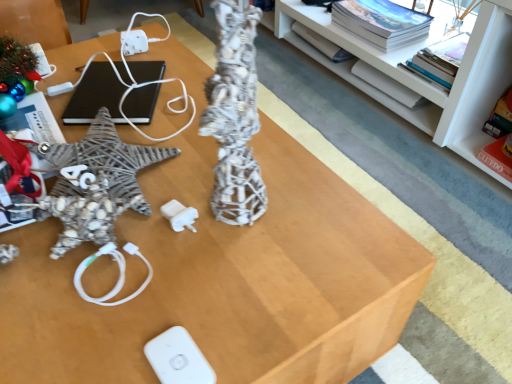
Locate an element on the screen. This screenshot has width=512, height=384. black matte laptop at upper left is located at coordinates (95, 96).

Measure the distance between black matte laptop at upper left and camera.

The distance of black matte laptop at upper left from camera is 36.25 inches.

What is the approximate height of shiny metallic ornament at upper left?

It is 7.13 centimeters.

What are the coordinates of `shiny metallic ornament at upper left` in the screenshot? It's located at (16, 62).

I want to click on black matte laptop at upper left, so click(95, 96).

From a real-world perspective, relative to black matte laptop at upper left, is white matte wii controller at lower center vertically above or below?

Clearly, from a real-world perspective, white matte wii controller at lower center is below black matte laptop at upper left.

Between white matte wii controller at lower center and black matte laptop at upper left, which one is positioned behind?

black matte laptop at upper left is further away from the camera.

Considering the relative sizes of white matte wii controller at lower center and black matte laptop at upper left in the image provided, is white matte wii controller at lower center wider than black matte laptop at upper left?

Incorrect, the width of white matte wii controller at lower center does not surpass that of black matte laptop at upper left.

From the image's perspective, is white matte wii controller at lower center beneath black matte laptop at upper left?

Yes.

Is shiny metallic ornament at upper left at the right side of black matte laptop at upper left?

In fact, shiny metallic ornament at upper left is to the left of black matte laptop at upper left.

Does shiny metallic ornament at upper left have a greater height compared to black matte laptop at upper left?

Correct, shiny metallic ornament at upper left is much taller as black matte laptop at upper left.

Does shiny metallic ornament at upper left turn towards black matte laptop at upper left?

No, shiny metallic ornament at upper left is not turned towards black matte laptop at upper left.

Is shiny metallic ornament at upper left thinner than black matte laptop at upper left?

Yes, shiny metallic ornament at upper left is thinner than black matte laptop at upper left.

From the image's perspective, relative to black matte laptop at upper left, is white glossy shelf at upper center above or below?

Based on their image positions, white glossy shelf at upper center is located above black matte laptop at upper left.

Does white glossy shelf at upper center touch black matte laptop at upper left?

They are not placed beside each other.

Does white glossy shelf at upper center have a greater height compared to black matte laptop at upper left?

Yes, white glossy shelf at upper center is taller than black matte laptop at upper left.

Which object is more forward, white glossy shelf at upper center or black matte laptop at upper left?

white glossy shelf at upper center is closer to the camera.

Is white glossy shelf at upper center at the left side of white matte wii controller at lower center?

No.

Is the depth of white glossy shelf at upper center greater than that of white matte wii controller at lower center?

Yes, white glossy shelf at upper center is behind white matte wii controller at lower center.

Is white glossy shelf at upper center not inside white matte wii controller at lower center?

Absolutely, white glossy shelf at upper center is external to white matte wii controller at lower center.

Based on the photo, considering the sizes of objects white glossy shelf at upper center and white matte wii controller at lower center in the image provided, who is bigger, white glossy shelf at upper center or white matte wii controller at lower center?

Bigger between the two is white glossy shelf at upper center.

Between white matte wii controller at lower center and shiny metallic ornament at upper left, which one is positioned in front?

white matte wii controller at lower center is more forward.

Which is correct: white matte wii controller at lower center is inside shiny metallic ornament at upper left, or outside of it?

white matte wii controller at lower center is spatially situated outside shiny metallic ornament at upper left.

From a real-world perspective, is white matte wii controller at lower center physically below shiny metallic ornament at upper left?

Yes, from a real-world perspective, white matte wii controller at lower center is beneath shiny metallic ornament at upper left.

Looking at this image, is white glossy shelf at upper center completely or partially inside shiny metallic ornament at upper left?

No, shiny metallic ornament at upper left does not contain white glossy shelf at upper center.

From a real-world perspective, is shiny metallic ornament at upper left positioned over white glossy shelf at upper center based on gravity?

Indeed, from a real-world perspective, shiny metallic ornament at upper left stands above white glossy shelf at upper center.

Are shiny metallic ornament at upper left and white glossy shelf at upper center far apart?

Yes, shiny metallic ornament at upper left is far from white glossy shelf at upper center.

Does shiny metallic ornament at upper left have a lesser width compared to white glossy shelf at upper center?

Correct, the width of shiny metallic ornament at upper left is less than that of white glossy shelf at upper center.

Visually, is white glossy shelf at upper center positioned to the left or to the right of shiny metallic ornament at upper left?

From the image, it's evident that white glossy shelf at upper center is to the right of shiny metallic ornament at upper left.

Between point (438, 101) and point (6, 82), which one is positioned behind?

The point (438, 101) is more distant.

Is white glossy shelf at upper center located outside shiny metallic ornament at upper left?

Yes, white glossy shelf at upper center is not within shiny metallic ornament at upper left.

Considering the relative sizes of white glossy shelf at upper center and shiny metallic ornament at upper left in the image provided, is white glossy shelf at upper center taller than shiny metallic ornament at upper left?

Yes, white glossy shelf at upper center is taller than shiny metallic ornament at upper left.

Locate an element on the screen. The width and height of the screenshot is (512, 384). laptop above the white matte wii controller at lower center (from a real-world perspective) is located at coordinates (95, 96).

Where is `christmas decoration behind the black matte laptop at upper left`? The width and height of the screenshot is (512, 384). christmas decoration behind the black matte laptop at upper left is located at coordinates (16, 62).

Based on their spatial positions, is shiny metallic ornament at upper left or black matte laptop at upper left closer to white glossy shelf at upper center?

black matte laptop at upper left is positioned closer to the anchor white glossy shelf at upper center.

When comparing their distances from white glossy shelf at upper center, does black matte laptop at upper left or shiny metallic ornament at upper left seem further?

Answer: shiny metallic ornament at upper left is further to white glossy shelf at upper center.

Estimate the real-world distances between objects in this image. Which object is closer to shiny metallic ornament at upper left, white matte wii controller at lower center or white glossy shelf at upper center?

The object closer to shiny metallic ornament at upper left is white matte wii controller at lower center.

When comparing their distances from white glossy shelf at upper center, does shiny metallic ornament at upper left or white matte wii controller at lower center seem further?

The object further to white glossy shelf at upper center is white matte wii controller at lower center.

Estimate the real-world distances between objects in this image. Which object is closer to black matte laptop at upper left, white glossy shelf at upper center or shiny metallic ornament at upper left?

shiny metallic ornament at upper left.

Which object lies nearer to the anchor point white matte wii controller at lower center, black matte laptop at upper left or white glossy shelf at upper center?

black matte laptop at upper left is closer to white matte wii controller at lower center.

When comparing their distances from black matte laptop at upper left, does white matte wii controller at lower center or shiny metallic ornament at upper left seem closer?

shiny metallic ornament at upper left lies closer to black matte laptop at upper left than the other object.

Looking at the image, which one is located further to shiny metallic ornament at upper left, black matte laptop at upper left or white glossy shelf at upper center?

white glossy shelf at upper center is further to shiny metallic ornament at upper left.

The image size is (512, 384). Identify the location of laptop that lies between shiny metallic ornament at upper left and white matte wii controller at lower center from top to bottom. (95, 96).

You are a GUI agent. You are given a task and a screenshot of the screen. Output one action in this format:
    pyautogui.click(x=<x>, y=<y>)
    Task: Click on the laptop located between shiny metallic ornament at upper left and white glossy shelf at upper center in the left-right direction
    Image resolution: width=512 pixels, height=384 pixels.
    Given the screenshot: What is the action you would take?
    pyautogui.click(x=95, y=96)

The width and height of the screenshot is (512, 384). What are the coordinates of `laptop between white glossy shelf at upper center and white matte wii controller at lower center from top to bottom` in the screenshot? It's located at (95, 96).

Identify the location of Wii controller between shiny metallic ornament at upper left and white glossy shelf at upper center. (178, 358).